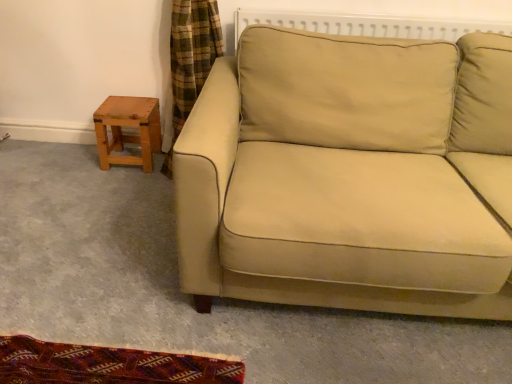
You are a GUI agent. You are given a task and a screenshot of the screen. Output one action in this format:
    pyautogui.click(x=<x>, y=<y>)
    Task: Click on the vacant space situated on the left part of light brown wooden stool at left
    The width and height of the screenshot is (512, 384).
    Given the screenshot: What is the action you would take?
    pyautogui.click(x=77, y=155)